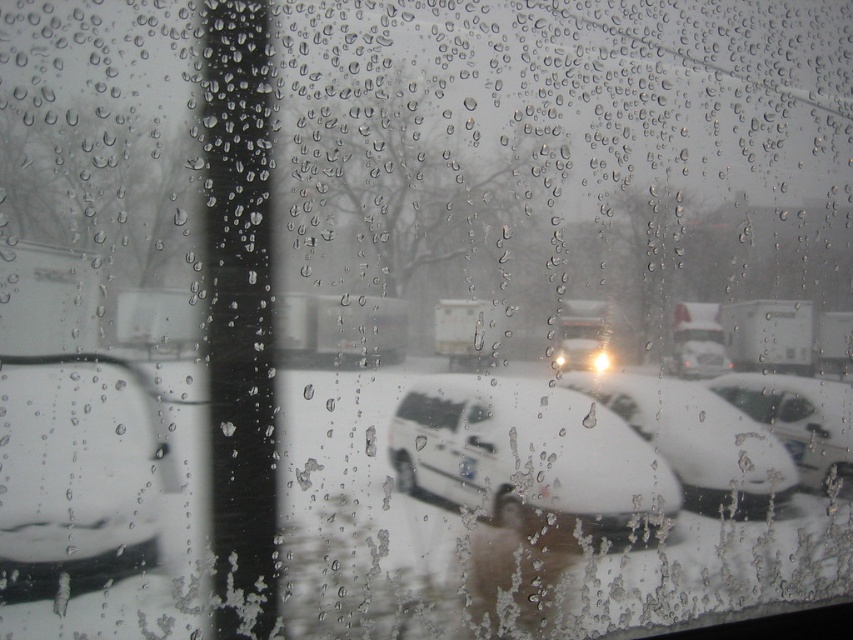
Where is `white matte car at left`? This screenshot has width=853, height=640. white matte car at left is located at coordinates (78, 472).

Does white matte car at left have a lesser height compared to white matte van at center?

No, white matte car at left is not shorter than white matte van at center.

Where is `white matte car at left`? The height and width of the screenshot is (640, 853). white matte car at left is located at coordinates (78, 472).

From the picture: Can you confirm if white matte car at left is positioned to the right of white matte car at right?

In fact, white matte car at left is to the left of white matte car at right.

Who is more forward, (131,442) or (776,384)?

Point (131,442) is in front.

Who is more distant from viewer, (161, 488) or (846, 417)?

Point (846, 417)

I want to click on white matte car at left, so click(x=78, y=472).

Based on the photo, does white matte car at left have a smaller size compared to white matte car at center?

Yes, white matte car at left is smaller than white matte car at center.

Does white matte car at left appear on the right side of white matte car at center?

Incorrect, white matte car at left is not on the right side of white matte car at center.

Is point (18, 508) closer to viewer compared to point (689, 381)?

That is True.

Identify the location of white matte car at left. The height and width of the screenshot is (640, 853). (x=78, y=472).